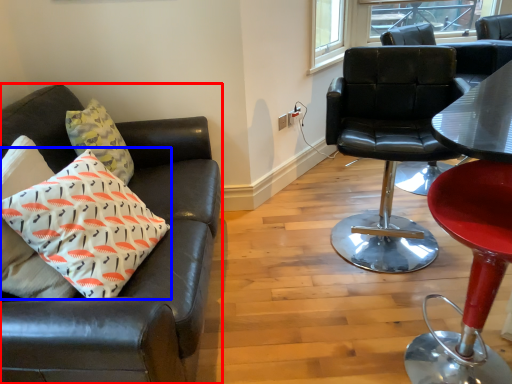
Question: Among these objects, which one is nearest to the camera, chair (highlighted by a red box) or pillow (highlighted by a blue box)?

Choices:
 (A) chair
 (B) pillow

Answer: (A)